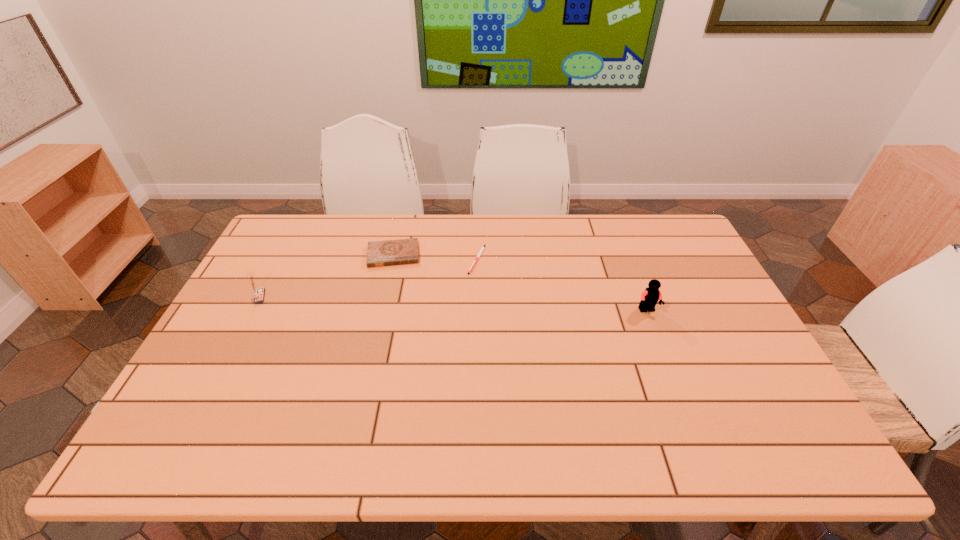
At what (x,y) coordinates should I click in order to perform the action: click on vacant area between the second nearest object and the third tallest object. Please return your answer as a coordinate pair (x, y). This screenshot has height=540, width=960. Looking at the image, I should click on (326, 276).

What are the coordinates of `empty location between the second object from left to right and the shortest object` in the screenshot? It's located at (435, 257).

At what (x,y) coordinates should I click in order to perform the action: click on free space between the shortest object and the third farthest object. Please return your answer as a coordinate pair (x, y). Image resolution: width=960 pixels, height=540 pixels. Looking at the image, I should click on (368, 278).

Identify the location of vacant area between the rightmost object and the third tallest object. (520, 282).

At what (x,y) coordinates should I click in order to perform the action: click on the second closest object relative to the second object from right to left. Please return your answer as a coordinate pair (x, y). Looking at the image, I should click on (649, 298).

Locate an element on the screen. object that ranks as the closest to the diary is located at coordinates (479, 254).

Locate an element on the screen. This screenshot has width=960, height=540. vacant space that satisfies the following two spatial constraints: 1. on the back side of the matchbox; 2. on the right side of the pen is located at coordinates [278, 259].